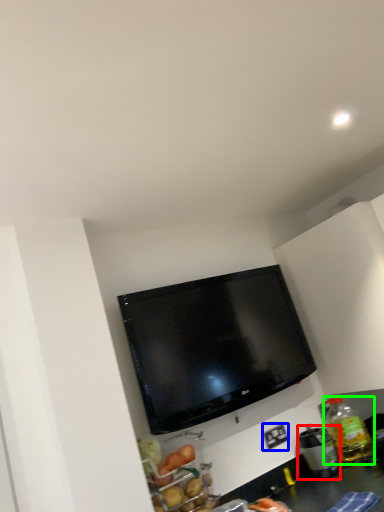
Question: Estimate the real-world distances between objects in this image. Which object is closer to appliance (highlighted by a red box), electric outlet (highlighted by a blue box) or bottle (highlighted by a green box)?

Choices:
 (A) electric outlet
 (B) bottle

Answer: (B)